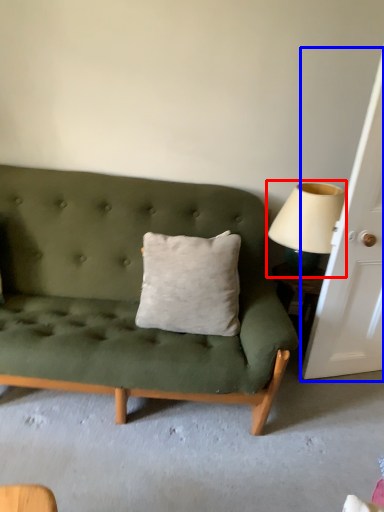
Question: Which of the following is the farthest to the observer, table lamp (highlighted by a red box) or door (highlighted by a blue box)?

Choices:
 (A) table lamp
 (B) door

Answer: (A)